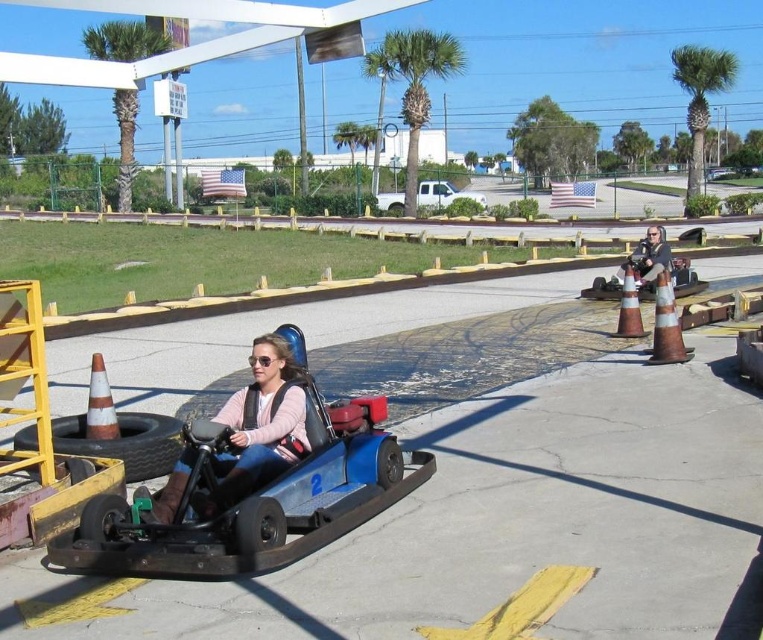
Question: Does orange reflective cone at right have a smaller size compared to white textured cone at center-right?

Choices:
 (A) yes
 (B) no

Answer: (A)

Question: Which point appears closest to the camera in this image?

Choices:
 (A) (652, 257)
 (B) (102, 385)
 (C) (733, 170)
 (D) (217, 496)

Answer: (D)

Question: Which point is farther to the camera?

Choices:
 (A) blue plastic go-kart at center
 (B) matte black camera at upper right

Answer: (B)

Question: Is the position of blue matte go-kart at center more distant than that of orange reflective cone at lower left?

Choices:
 (A) yes
 (B) no

Answer: (B)

Question: Does blue matte go-kart at center appear under matte black camera at upper right?

Choices:
 (A) yes
 (B) no

Answer: (A)

Question: Estimate the real-world distances between objects in this image. Which object is closer to the matte black camera at upper right?

Choices:
 (A) matte blue go-kart at center
 (B) orange reflective cone at lower left

Answer: (B)